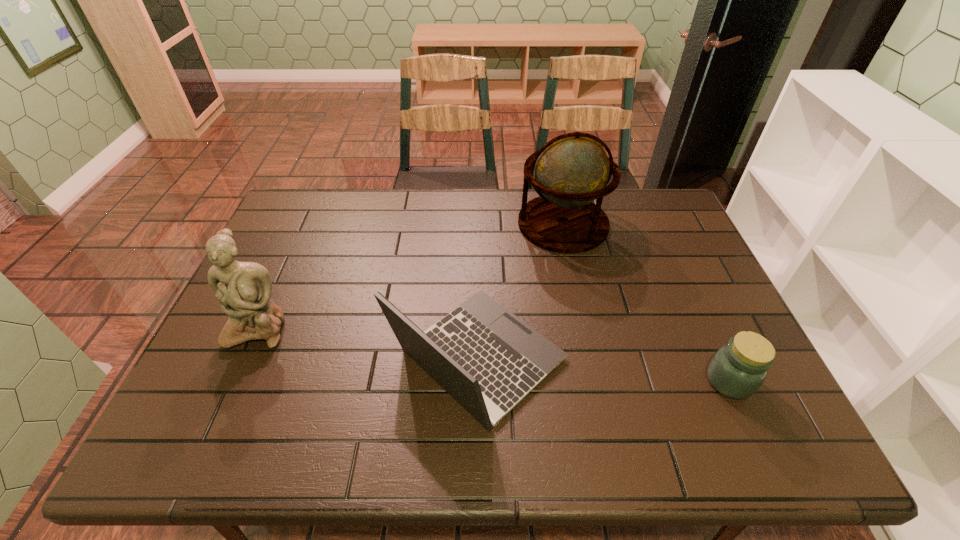
Identify the location of free space located 0.150m on the left of the jar. (641, 381).

Locate an element on the screen. This screenshot has width=960, height=540. object that is at the far edge is located at coordinates (571, 170).

You are a GUI agent. You are given a task and a screenshot of the screen. Output one action in this format:
    pyautogui.click(x=<x>, y=<y>)
    Task: Click on the object positioned at the near edge
    The image size is (960, 540).
    Given the screenshot: What is the action you would take?
    [485, 357]

This screenshot has width=960, height=540. What are the coordinates of `object at the left edge` in the screenshot? It's located at (244, 289).

At what (x,y) coordinates should I click in order to perform the action: click on object positioned at the right edge. Please return your answer as a coordinate pair (x, y). The height and width of the screenshot is (540, 960). Looking at the image, I should click on coord(737,370).

Locate an element on the screen. This screenshot has width=960, height=540. free location at the far edge is located at coordinates (459, 208).

Find the location of a particular element. Image resolution: width=960 pixels, height=540 pixels. vacant space at the near edge of the desktop is located at coordinates (678, 431).

Locate an element on the screen. The height and width of the screenshot is (540, 960). free space at the left edge of the desktop is located at coordinates (289, 250).

The image size is (960, 540). Find the location of `vacant space at the right edge of the desktop`. vacant space at the right edge of the desktop is located at coordinates (724, 312).

Where is `empty space that is in between the shortest object and the second shortest object`? Image resolution: width=960 pixels, height=540 pixels. empty space that is in between the shortest object and the second shortest object is located at coordinates (604, 370).